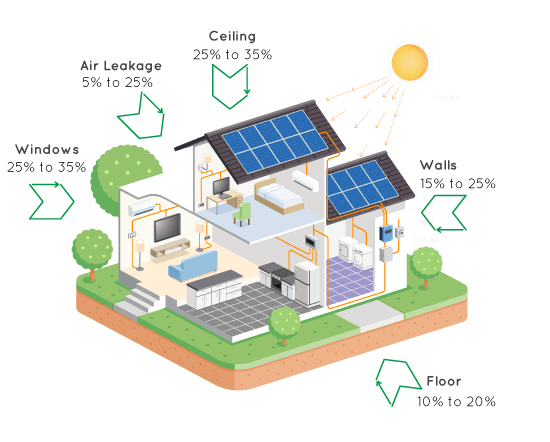
This screenshot has height=442, width=550. Find the location of `stairs`. stairs is located at coordinates (137, 297).